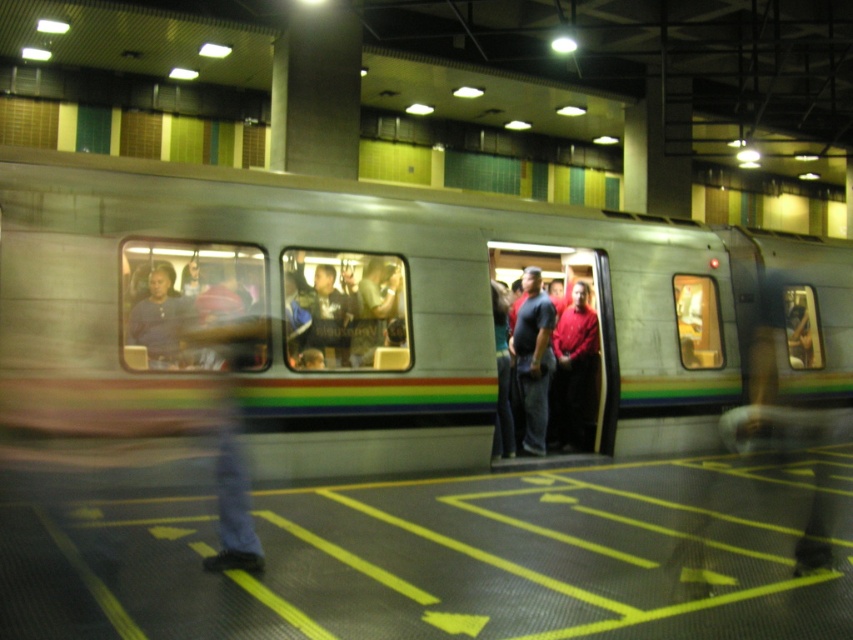
Is metallic silver train at center to the left of dark blue jeans at center from the viewer's perspective?

No, metallic silver train at center is not to the left of dark blue jeans at center.

You are a GUI agent. You are given a task and a screenshot of the screen. Output one action in this format:
    pyautogui.click(x=<x>, y=<y>)
    Task: Click on the metallic silver train at center
    
    Given the screenshot: What is the action you would take?
    pyautogui.click(x=376, y=316)

Where is `metallic silver train at center`? metallic silver train at center is located at coordinates (376, 316).

Is dark blue jeans at center taller than matte blue shirt at left?

Indeed, dark blue jeans at center has a greater height compared to matte blue shirt at left.

Is point (538, 429) behind point (148, 321)?

Yes.

This screenshot has height=640, width=853. Find the location of `dark blue jeans at center`. dark blue jeans at center is located at coordinates (532, 358).

You are a GUI agent. You are given a task and a screenshot of the screen. Output one action in this format:
    pyautogui.click(x=<x>, y=<y>)
    Task: Click on the dark blue jeans at center
    The width and height of the screenshot is (853, 640).
    Given the screenshot: What is the action you would take?
    pyautogui.click(x=532, y=358)

Who is more forward, (287, 312) or (540, 273)?

Positioned in front is point (287, 312).

Is matte black shirt at left positioned before dark blue jeans at center?

Yes, matte black shirt at left is closer to the viewer.

Who is more distant from viewer, (263, 344) or (547, 412)?

The point (547, 412) is behind.

This screenshot has height=640, width=853. In order to click on matte black shirt at left in this screenshot , I will do `click(190, 305)`.